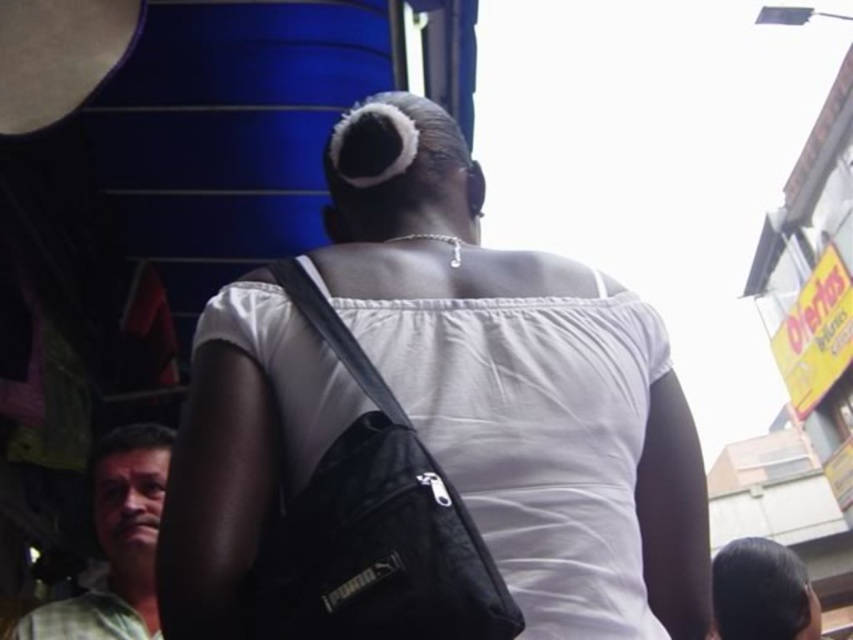
Which is in front, point (670, 483) or point (142, 484)?

Point (670, 483) is in front.

Does white matte shoulder bag at center appear over green plaid shirt at lower left?

Correct, white matte shoulder bag at center is located above green plaid shirt at lower left.

This screenshot has width=853, height=640. What do you see at coordinates (521, 385) in the screenshot?
I see `white matte shoulder bag at center` at bounding box center [521, 385].

What are the coordinates of `white matte shoulder bag at center` in the screenshot? It's located at (521, 385).

Between black fabric shoulder bag at center and green plaid shirt at lower left, which one appears on the left side from the viewer's perspective?

From the viewer's perspective, green plaid shirt at lower left appears more on the left side.

In the scene shown: Is black fabric shoulder bag at center below green plaid shirt at lower left?

No, black fabric shoulder bag at center is not below green plaid shirt at lower left.

Is point (334, 611) in front of point (138, 477)?

Yes, point (334, 611) is in front of point (138, 477).

Find the location of a particular element. This screenshot has height=640, width=853. black fabric shoulder bag at center is located at coordinates (373, 525).

Identify the location of white matte shoulder bag at center. (521, 385).

Does white matte shoulder bag at center appear under black fabric shoulder bag at center?

No.

Where is `white matte shoulder bag at center`? white matte shoulder bag at center is located at coordinates (521, 385).

The image size is (853, 640). Identify the location of white matte shoulder bag at center. (521, 385).